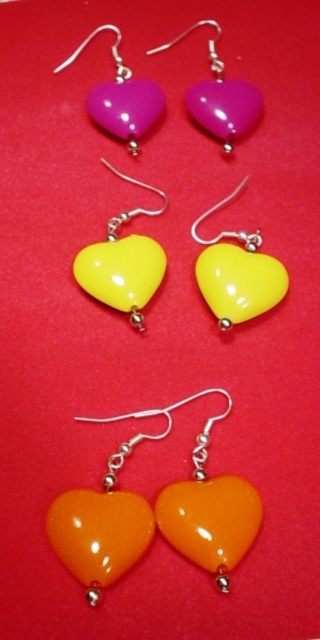
Does point (63, 508) come closer to viewer compared to point (224, 248)?

Yes, point (63, 508) is in front of point (224, 248).

Between glossy orange heart at bottom and glossy plastic heart at center, which one appears on the left side from the viewer's perspective?

glossy orange heart at bottom is more to the left.

Which is in front, point (110, 492) or point (273, 288)?

Positioned in front is point (110, 492).

Locate an element on the screen. glossy orange heart at bottom is located at coordinates (x=104, y=518).

Does glossy orange heart at bottom appear on the left side of purple glossy heart at upper center?

Incorrect, glossy orange heart at bottom is not on the left side of purple glossy heart at upper center.

Is point (104, 548) behind point (122, 74)?

No, (104, 548) is in front of (122, 74).

Locate an element on the screen. The image size is (320, 640). glossy orange heart at bottom is located at coordinates (104, 518).

Is orange glossy heart at bottom closer to the viewer compared to yellow glossy heart at center?

Yes.

Between orange glossy heart at bottom and yellow glossy heart at center, which one has more height?

With more height is yellow glossy heart at center.

Who is more forward, (x=206, y=502) or (x=112, y=272)?

Point (x=206, y=502) is in front.

The height and width of the screenshot is (640, 320). Identify the location of orange glossy heart at bottom. (209, 509).